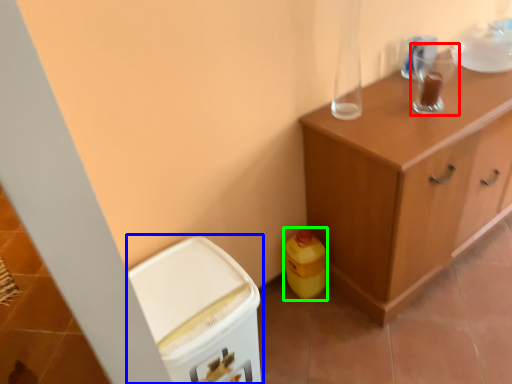
Question: Considering the real-world distances, which object is farthest from appliance (highlighted by a red box)? cabinetry (highlighted by a blue box) or cleaning product (highlighted by a green box)?

Choices:
 (A) cabinetry
 (B) cleaning product

Answer: (A)